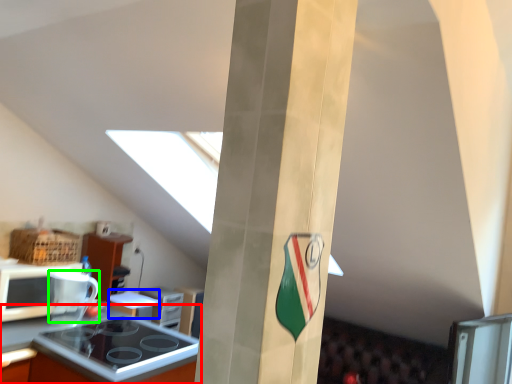
Question: Which object is positioned closest to countertop (highlighted by a red box)? Select from appliance (highlighted by a blue box) and appliance (highlighted by a green box).

Choices:
 (A) appliance
 (B) appliance

Answer: (B)